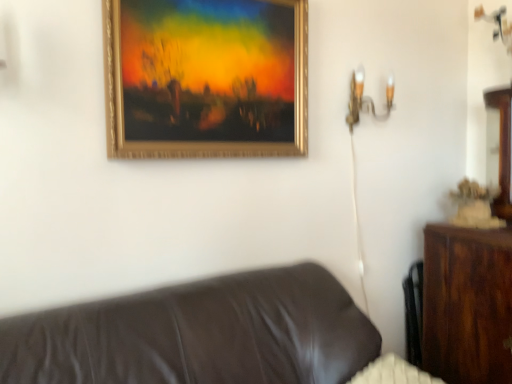
Question: Is gold metallic wall sconce at upper right wider than brown leather couch at lower left?

Choices:
 (A) yes
 (B) no

Answer: (B)

Question: From the image's perspective, is gold metallic wall sconce at upper right on top of brown leather couch at lower left?

Choices:
 (A) yes
 (B) no

Answer: (A)

Question: Considering the relative sizes of gold metallic wall sconce at upper right and brown leather couch at lower left in the image provided, is gold metallic wall sconce at upper right smaller than brown leather couch at lower left?

Choices:
 (A) no
 (B) yes

Answer: (B)

Question: Could you tell me if gold metallic wall sconce at upper right is facing brown leather couch at lower left?

Choices:
 (A) no
 (B) yes

Answer: (A)

Question: Is gold metallic wall sconce at upper right at the right side of brown leather couch at lower left?

Choices:
 (A) no
 (B) yes

Answer: (B)

Question: Is gold metallic wall sconce at upper right further to the viewer compared to brown leather couch at lower left?

Choices:
 (A) yes
 (B) no

Answer: (A)

Question: Is the depth of gold metallic wall sconce at upper right less than that of gold metallic picture frame at upper center?

Choices:
 (A) no
 (B) yes

Answer: (A)

Question: From the image's perspective, does gold metallic wall sconce at upper right appear higher than gold metallic picture frame at upper center?

Choices:
 (A) no
 (B) yes

Answer: (A)

Question: Is gold metallic wall sconce at upper right positioned behind gold metallic picture frame at upper center?

Choices:
 (A) yes
 (B) no

Answer: (A)

Question: Is gold metallic wall sconce at upper right to the right of gold metallic picture frame at upper center from the viewer's perspective?

Choices:
 (A) no
 (B) yes

Answer: (B)

Question: Is gold metallic wall sconce at upper right at the left side of gold metallic picture frame at upper center?

Choices:
 (A) no
 (B) yes

Answer: (A)

Question: From a real-world perspective, is gold metallic wall sconce at upper right beneath gold metallic picture frame at upper center?

Choices:
 (A) no
 (B) yes

Answer: (B)

Question: Can you confirm if brown leather couch at lower left is wider than gold metallic picture frame at upper center?

Choices:
 (A) no
 (B) yes

Answer: (B)